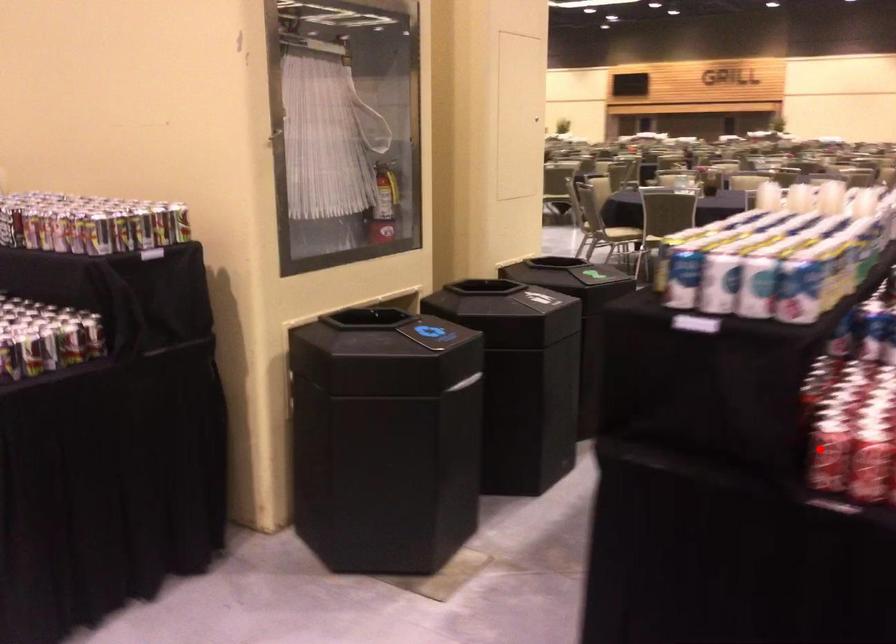
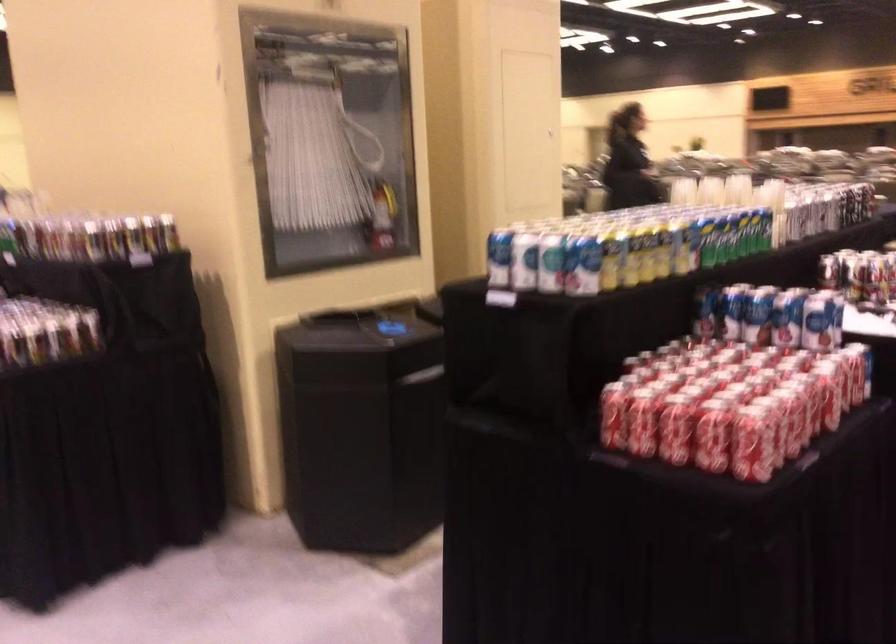
Where in the second image is the point corresponding to the highlighted location from the first image?

(613, 413)